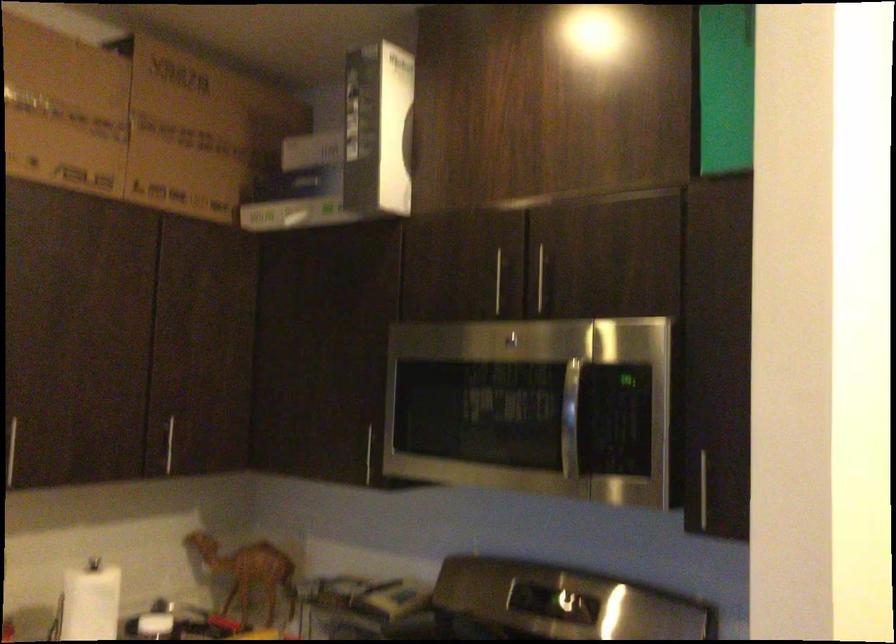
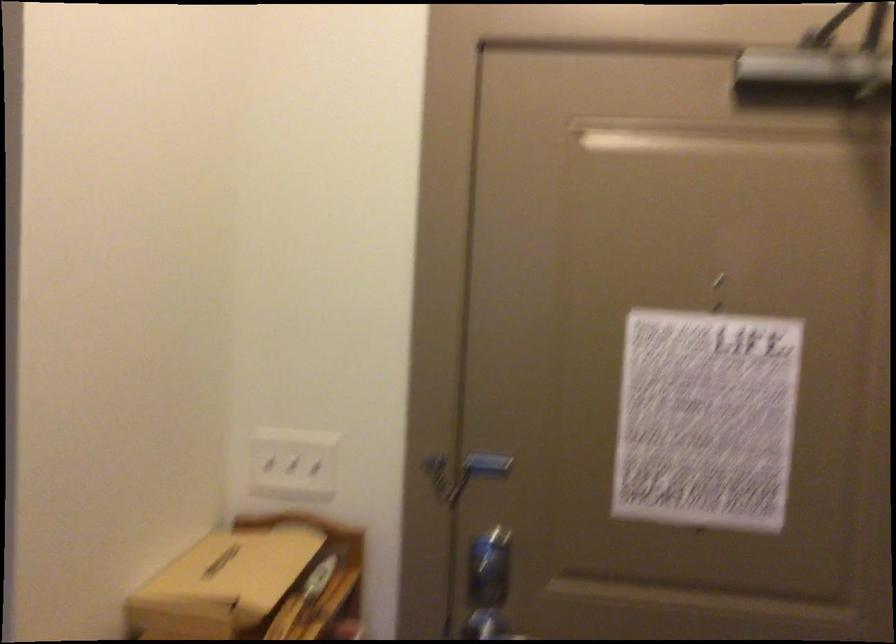
Question: Which direction would the cameraman need to move to produce the second image? Reply with the corresponding letter.

Choices:
 (A) Left
 (B) Right
 (C) Forward
 (D) Backward

Answer: (B)